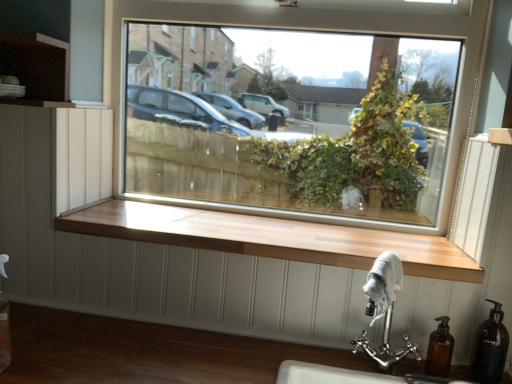
The image size is (512, 384). In order to click on vacant point above wooden at center (from a real-world perspective) in this screenshot , I will do `click(290, 233)`.